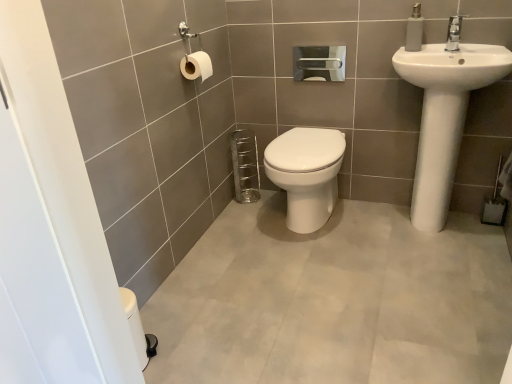
Where is `vacant area that is in front of white glossy toilet at center`? vacant area that is in front of white glossy toilet at center is located at coordinates (321, 266).